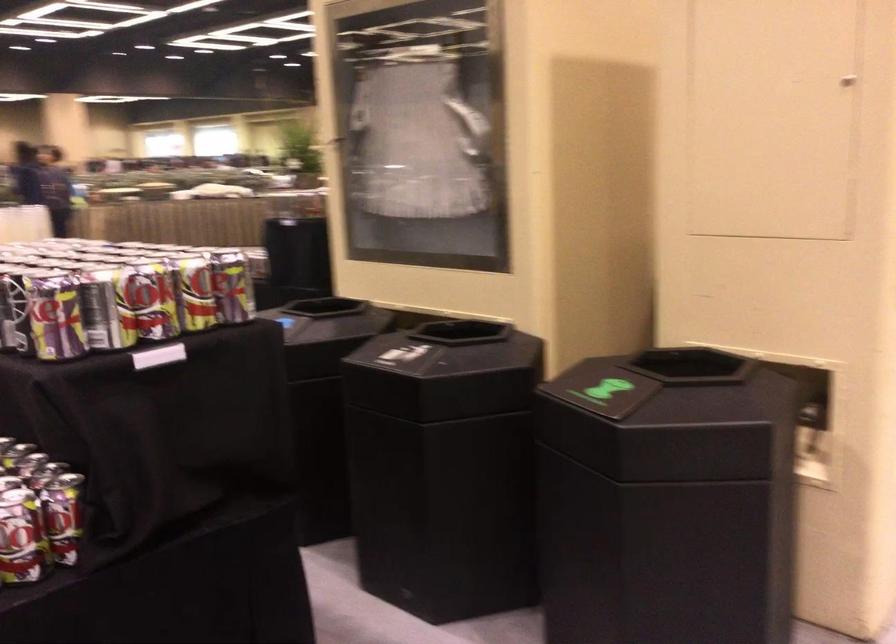
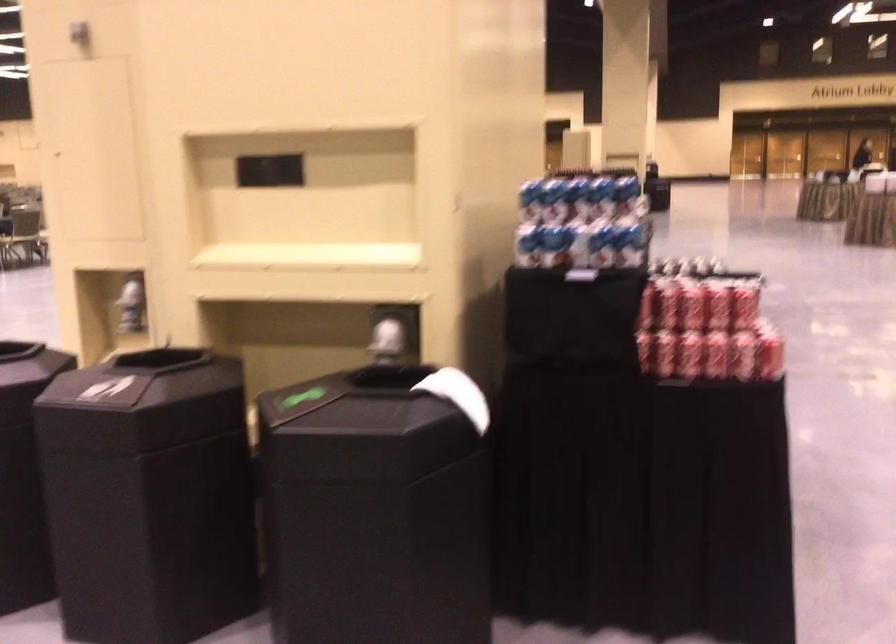
Question: I am providing you with two images of the same scene from different viewpoints. Please identify which objects are invisible in image2.

Choices:
 (A) beverage can
 (B) red soda can
 (C) white round pillow
 (D) blue and white can

Answer: (A)